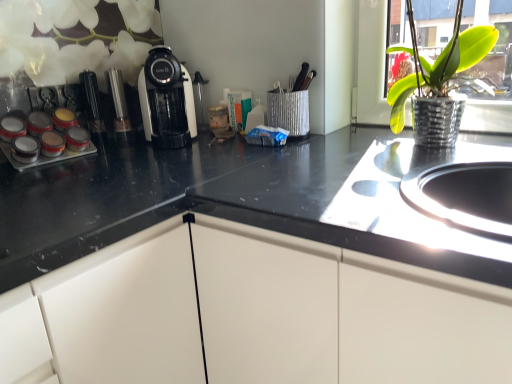
What do you see at coordinates (44, 156) in the screenshot? Image resolution: width=512 pixels, height=384 pixels. I see `metallic silver spice rack at left` at bounding box center [44, 156].

At what (x,y) coordinates should I click in order to perform the action: click on metallic silver spice rack at left. Please return your answer as a coordinate pair (x, y). The height and width of the screenshot is (384, 512). Looking at the image, I should click on (44, 156).

Which object is more forward, metallic silver spice rack at left or white glossy coffee machine at center?

metallic silver spice rack at left.

From the image's perspective, which one is positioned lower, metallic silver spice rack at left or white glossy coffee machine at center?

metallic silver spice rack at left appears lower in the image.

From the picture: Does metallic silver spice rack at left contain white glossy coffee machine at center?

No, metallic silver spice rack at left does not contain white glossy coffee machine at center.

Which is more to the right, metallic silver spice rack at left or white glossy coffee machine at center?

white glossy coffee machine at center.

How many degrees apart are the facing directions of green metallic pot at upper right and metallic silver spice rack at left?

89.4 degrees.

Which is more to the left, green metallic pot at upper right or metallic silver spice rack at left?

Positioned to the left is metallic silver spice rack at left.

In the scene shown: Are green metallic pot at upper right and metallic silver spice rack at left located far from each other?

No, green metallic pot at upper right is not far away from metallic silver spice rack at left.

Locate an element on the screen. The width and height of the screenshot is (512, 384). houseplant above the metallic silver spice rack at left (from the image's perspective) is located at coordinates (437, 83).

Does green metallic pot at upper right have a larger size compared to white glossy coffee machine at center?

Indeed, green metallic pot at upper right has a larger size compared to white glossy coffee machine at center.

Considering the positions of point (430, 67) and point (184, 122), is point (430, 67) closer or farther from the camera than point (184, 122)?

Clearly, point (430, 67) is closer to the camera than point (184, 122).

Does green metallic pot at upper right have a lesser height compared to white glossy coffee machine at center?

No, green metallic pot at upper right is not shorter than white glossy coffee machine at center.

Consider the image. Could you tell me if green metallic pot at upper right is facing white glossy coffee machine at center?

No, green metallic pot at upper right does not turn towards white glossy coffee machine at center.

Image resolution: width=512 pixels, height=384 pixels. What are the coordinates of `kitchen appliance on the right of metallic silver spice rack at left` in the screenshot? It's located at (166, 100).

Does white glossy coffee machine at center touch metallic silver spice rack at left?

No, white glossy coffee machine at center is not in contact with metallic silver spice rack at left.

Is white glossy coffee machine at center looking in the opposite direction of metallic silver spice rack at left?

No.

Is white glossy coffee machine at center closer to the viewer compared to metallic silver spice rack at left?

No.

Is white glossy coffee machine at center outside of green metallic pot at upper right?

That's correct, white glossy coffee machine at center is outside of green metallic pot at upper right.

Is white glossy coffee machine at center aimed at green metallic pot at upper right?

No, white glossy coffee machine at center is not facing towards green metallic pot at upper right.

How far apart are white glossy coffee machine at center and green metallic pot at upper right?

white glossy coffee machine at center is 26.58 inches away from green metallic pot at upper right.

Considering the relative positions of white glossy coffee machine at center and green metallic pot at upper right in the image provided, is white glossy coffee machine at center to the left of green metallic pot at upper right from the viewer's perspective?

Correct, you'll find white glossy coffee machine at center to the left of green metallic pot at upper right.

Would you say metallic silver spice rack at left is a long distance from green metallic pot at upper right?

No, there isn't a large distance between metallic silver spice rack at left and green metallic pot at upper right.

The width and height of the screenshot is (512, 384). Find the location of `houseplant above the metallic silver spice rack at left (from a real-world perspective)`. houseplant above the metallic silver spice rack at left (from a real-world perspective) is located at coordinates (437, 83).

Can you confirm if metallic silver spice rack at left is shorter than green metallic pot at upper right?

Yes, metallic silver spice rack at left is shorter than green metallic pot at upper right.

Is metallic silver spice rack at left positioned with its back to green metallic pot at upper right?

No, metallic silver spice rack at left is not facing the opposite direction of green metallic pot at upper right.

In the image, there is a white glossy coffee machine at center. What are the coordinates of `appliance below it (from a real-world perspective)` in the screenshot? It's located at (44, 156).

This screenshot has width=512, height=384. I want to click on appliance below the green metallic pot at upper right (from the image's perspective), so click(44, 156).

From the image, which object appears to be nearer to metallic silver spice rack at left, white glossy coffee machine at center or green metallic pot at upper right?

Based on the image, white glossy coffee machine at center appears to be nearer to metallic silver spice rack at left.

From the image, which object appears to be nearer to green metallic pot at upper right, metallic silver spice rack at left or white glossy coffee machine at center?

white glossy coffee machine at center lies closer to green metallic pot at upper right than the other object.

Which object lies further to the anchor point metallic silver spice rack at left, green metallic pot at upper right or white glossy coffee machine at center?

The object further to metallic silver spice rack at left is green metallic pot at upper right.

Based on their spatial positions, is metallic silver spice rack at left or green metallic pot at upper right further from white glossy coffee machine at center?

The object further to white glossy coffee machine at center is green metallic pot at upper right.

When comparing their distances from white glossy coffee machine at center, does green metallic pot at upper right or metallic silver spice rack at left seem further?

Based on the image, green metallic pot at upper right appears to be further to white glossy coffee machine at center.

Looking at the image, which one is located closer to green metallic pot at upper right, white glossy coffee machine at center or metallic silver spice rack at left?

Based on the image, white glossy coffee machine at center appears to be nearer to green metallic pot at upper right.

Image resolution: width=512 pixels, height=384 pixels. I want to click on kitchen appliance between metallic silver spice rack at left and green metallic pot at upper right from left to right, so click(x=166, y=100).